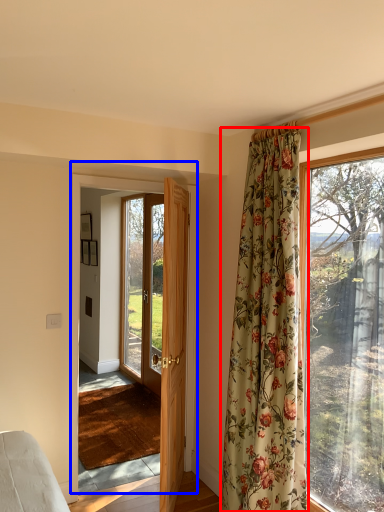
Question: Among these objects, which one is farthest to the camera, curtain (highlighted by a red box) or door (highlighted by a blue box)?

Choices:
 (A) curtain
 (B) door

Answer: (B)